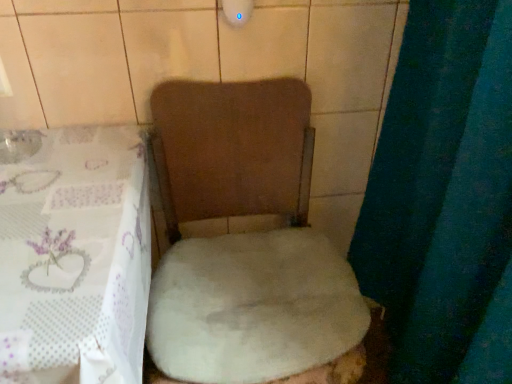
Locate an element on the screen. The image size is (512, 384). white sheer tablecloth at lower left is located at coordinates (73, 255).

This screenshot has width=512, height=384. What are the coordinates of `white fluffy toilet at center` in the screenshot? It's located at (246, 240).

Locate an element on the screen. The height and width of the screenshot is (384, 512). white fluffy rug at center is located at coordinates [252, 307].

Where is `white sheer tablecloth at lower left`? This screenshot has width=512, height=384. white sheer tablecloth at lower left is located at coordinates (73, 255).

Considering the relative sizes of white fluffy rug at center and white fluffy toilet at center in the image provided, is white fluffy rug at center wider than white fluffy toilet at center?

In fact, white fluffy rug at center might be narrower than white fluffy toilet at center.

Is white fluffy rug at center bigger or smaller than white fluffy toilet at center?

white fluffy rug at center is smaller than white fluffy toilet at center.

Considering the sizes of white fluffy rug at center and white fluffy toilet at center in the image, is white fluffy rug at center taller or shorter than white fluffy toilet at center?

Clearly, white fluffy rug at center is shorter compared to white fluffy toilet at center.

Is white fluffy rug at center positioned before white fluffy toilet at center?

No, white fluffy rug at center is further to the viewer.

Between white fluffy toilet at center and white fluffy rug at center, which one has more height?

With more height is white fluffy toilet at center.

How far apart are white fluffy toilet at center and white fluffy rug at center?

A distance of 1.98 inches exists between white fluffy toilet at center and white fluffy rug at center.

Which of these two, white fluffy toilet at center or white fluffy rug at center, is bigger?

With larger size is white fluffy toilet at center.

Is white fluffy toilet at center inside the boundaries of white fluffy rug at center, or outside?

white fluffy toilet at center exists outside the volume of white fluffy rug at center.

This screenshot has width=512, height=384. I want to click on table directly beneath the white fluffy rug at center (from a real-world perspective), so click(73, 255).

Which object is wider, white sheer tablecloth at lower left or white fluffy rug at center?

With larger width is white sheer tablecloth at lower left.

Is white sheer tablecloth at lower left closer to the viewer compared to white fluffy rug at center?

That is True.

Measure the distance from white sheer tablecloth at lower left to white fluffy rug at center.

They are 10.64 inches apart.

Identify the location of toilet that appears behind the white sheer tablecloth at lower left. (246, 240).

From the picture: Does white fluffy toilet at center have a lesser width compared to white sheer tablecloth at lower left?

Yes, white fluffy toilet at center is thinner than white sheer tablecloth at lower left.

Is white fluffy toilet at center facing towards white sheer tablecloth at lower left?

No, white fluffy toilet at center does not turn towards white sheer tablecloth at lower left.

Between white fluffy rug at center and white sheer tablecloth at lower left, which one appears on the left side from the viewer's perspective?

From the viewer's perspective, white sheer tablecloth at lower left appears more on the left side.

Where is `table that is on the left side of white fluffy rug at center`? The height and width of the screenshot is (384, 512). table that is on the left side of white fluffy rug at center is located at coordinates (73, 255).

Which object is wider, white fluffy rug at center or white sheer tablecloth at lower left?

With larger width is white sheer tablecloth at lower left.

Is white sheer tablecloth at lower left further to camera compared to white fluffy toilet at center?

No, the depth of white sheer tablecloth at lower left is less than that of white fluffy toilet at center.

From a real-world perspective, is white sheer tablecloth at lower left on top of white fluffy toilet at center?

No, from a real-world perspective, white sheer tablecloth at lower left is not above white fluffy toilet at center.

In the image, there is a white fluffy toilet at center. In order to click on table below it (from the image's perspective) in this screenshot , I will do `click(73, 255)`.

Locate an element on the screen. Image resolution: width=512 pixels, height=384 pixels. toilet located below the white fluffy rug at center (from the image's perspective) is located at coordinates (246, 240).

Find the location of a particular element. toilet on the left of white fluffy rug at center is located at coordinates (246, 240).

When comparing their distances from white fluffy toilet at center, does white fluffy rug at center or white sheer tablecloth at lower left seem closer?

Among the two, white fluffy rug at center is located nearer to white fluffy toilet at center.

When comparing their distances from white fluffy rug at center, does white sheer tablecloth at lower left or white fluffy toilet at center seem further?

Among the two, white sheer tablecloth at lower left is located further to white fluffy rug at center.

Based on their spatial positions, is white fluffy toilet at center or white fluffy rug at center closer to white sheer tablecloth at lower left?

white fluffy toilet at center lies closer to white sheer tablecloth at lower left than the other object.

Considering their positions, is white sheer tablecloth at lower left positioned further to white fluffy toilet at center than white fluffy rug at center?

white sheer tablecloth at lower left is positioned further to the anchor white fluffy toilet at center.

From the image, which object appears to be farther from white sheer tablecloth at lower left, white fluffy rug at center or white fluffy toilet at center?

white fluffy rug at center lies further to white sheer tablecloth at lower left than the other object.

Considering their positions, is white fluffy toilet at center positioned further to white fluffy rug at center than white sheer tablecloth at lower left?

Among the two, white sheer tablecloth at lower left is located further to white fluffy rug at center.

At what (x,y) coordinates should I click in order to perform the action: click on toilet between white sheer tablecloth at lower left and white fluffy rug at center from left to right. Please return your answer as a coordinate pair (x, y). This screenshot has height=384, width=512. Looking at the image, I should click on (246, 240).